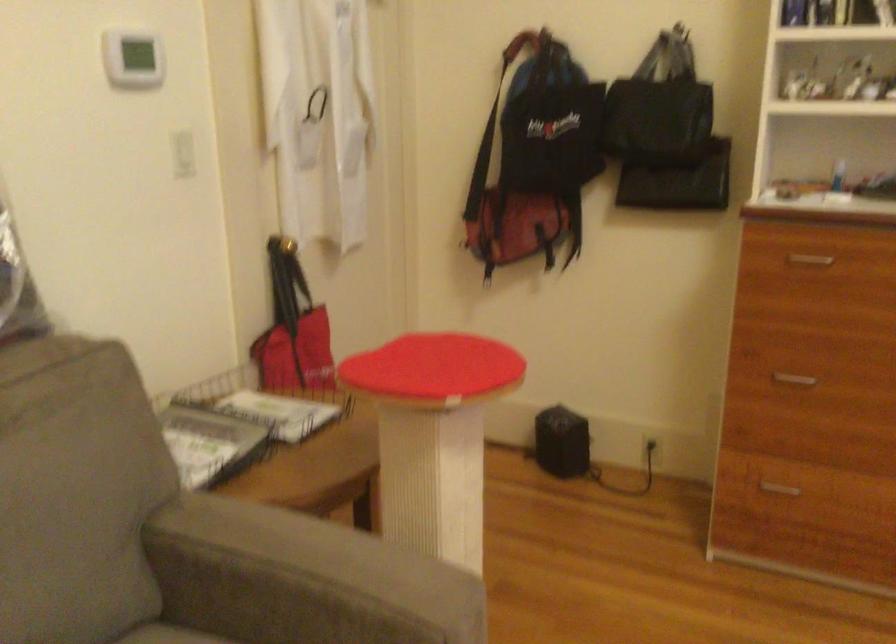
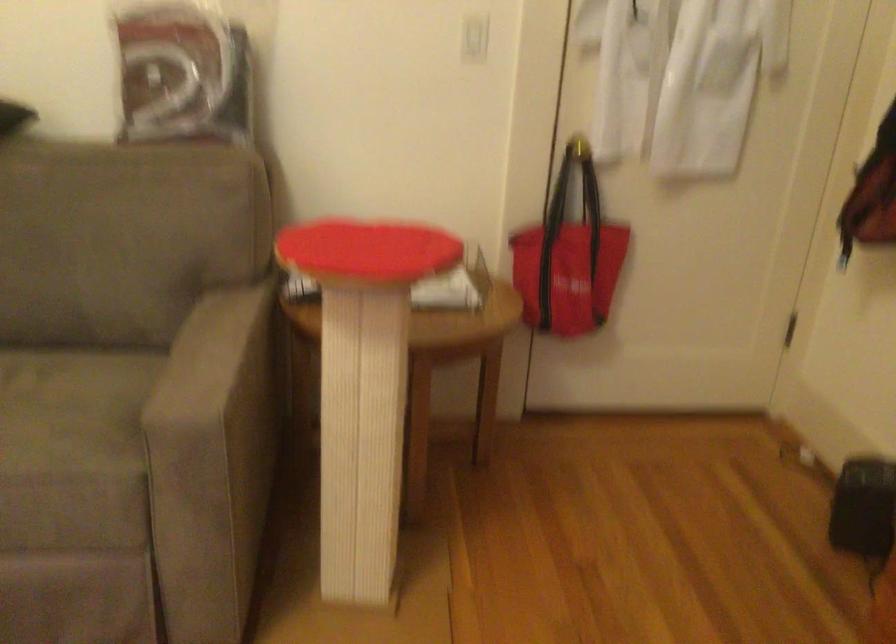
The point at (185,160) is marked in the first image. Where is the corresponding point in the second image?

(474, 38)